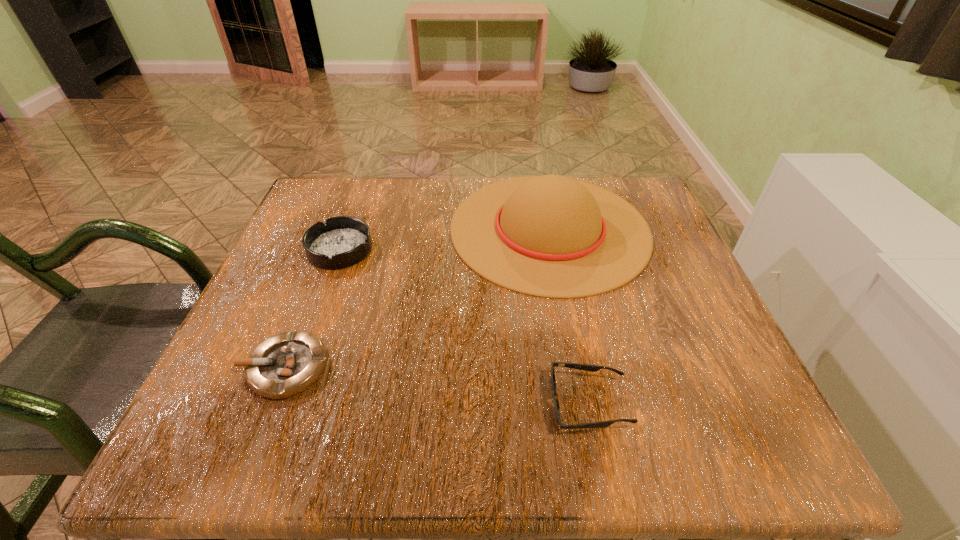
At what (x,y) coordinates should I click in order to perform the action: click on free space at the far left corner. Please return your answer as a coordinate pair (x, y). Looking at the image, I should click on (294, 232).

Where is `vacant space at the near left corner of the desktop`? vacant space at the near left corner of the desktop is located at coordinates tap(214, 458).

The height and width of the screenshot is (540, 960). I want to click on vacant region at the near right corner of the desktop, so click(x=745, y=450).

The height and width of the screenshot is (540, 960). Find the location of `free space between the tallest object and the sunglasses`. free space between the tallest object and the sunglasses is located at coordinates (569, 316).

Where is `free space between the farther ashtray and the nearer ashtray`? The width and height of the screenshot is (960, 540). free space between the farther ashtray and the nearer ashtray is located at coordinates (313, 308).

Where is `unoccupied area between the tallest object and the sunglasses`? The width and height of the screenshot is (960, 540). unoccupied area between the tallest object and the sunglasses is located at coordinates (569, 316).

Find the location of `free space that is in between the farther ashtray and the tallest object`. free space that is in between the farther ashtray and the tallest object is located at coordinates (444, 239).

The width and height of the screenshot is (960, 540). Identify the location of vacant area that lies between the nearer ashtray and the tallest object. (418, 298).

The height and width of the screenshot is (540, 960). In order to click on vacant space that is in between the sombrero and the farther ashtray in this screenshot , I will do `click(444, 239)`.

The image size is (960, 540). I want to click on free point between the sunglasses and the farther ashtray, so click(465, 327).